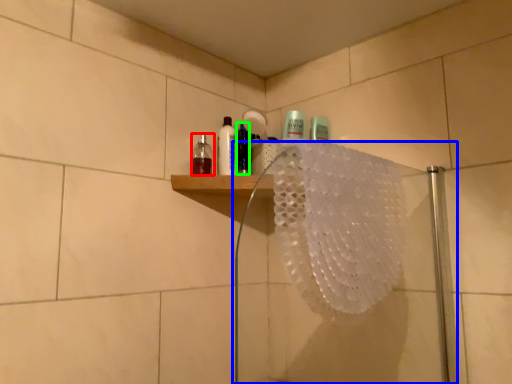
Question: Considering the real-world distances, which object is closest to mouthwash (highlighted by a red box)? shower door (highlighted by a blue box) or mouthwash (highlighted by a green box).

Choices:
 (A) shower door
 (B) mouthwash

Answer: (B)